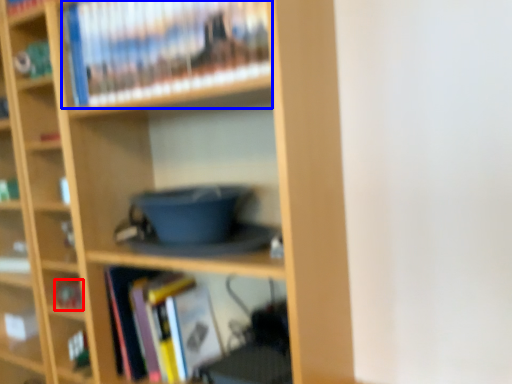
Question: Which object is further to the camera taking this photo, book (highlighted by a red box) or book (highlighted by a blue box)?

Choices:
 (A) book
 (B) book

Answer: (A)